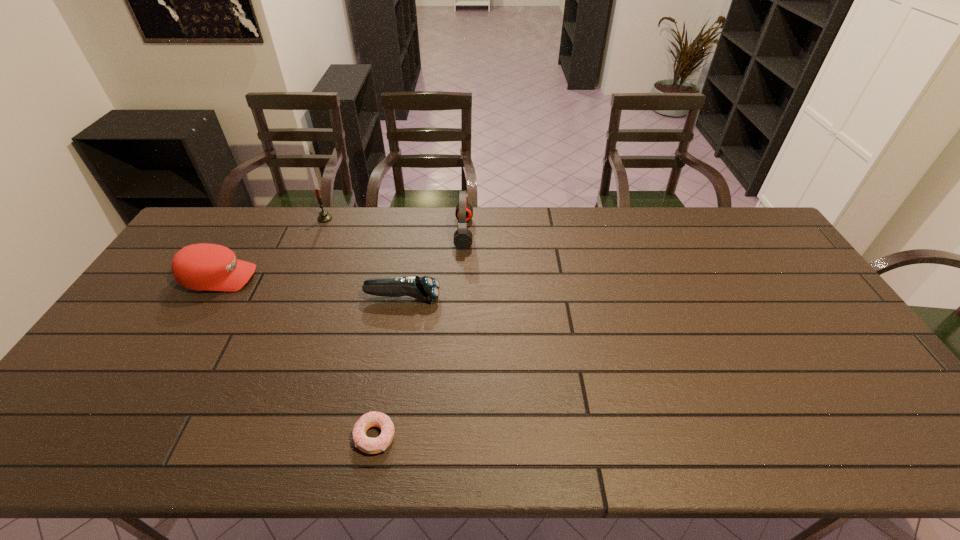
What are the coordinates of `vacant space that's between the second shortest object and the rightmost object` in the screenshot? It's located at (433, 265).

Identify which object is located as the fourth nearest to the electric shaver. Please provide its 2D coordinates. Your answer should be formatted as a tuple, i.e. [(x, y)], where the tuple contains the x and y coordinates of a point satisfying the conditions above.

[(324, 216)]

In order to click on object that is the fourth closest one to the electric shaver in this screenshot , I will do `click(324, 216)`.

Locate an element on the screen. free spot that satisfies the following two spatial constraints: 1. on the front side of the fourth object from right to left; 2. on the right side of the shortest object is located at coordinates (233, 436).

Where is `blank area in the image that satisfies the following two spatial constraints: 1. on the front-facing side of the leftmost object; 2. on the right side of the nearest object`? The image size is (960, 540). blank area in the image that satisfies the following two spatial constraints: 1. on the front-facing side of the leftmost object; 2. on the right side of the nearest object is located at coordinates (124, 436).